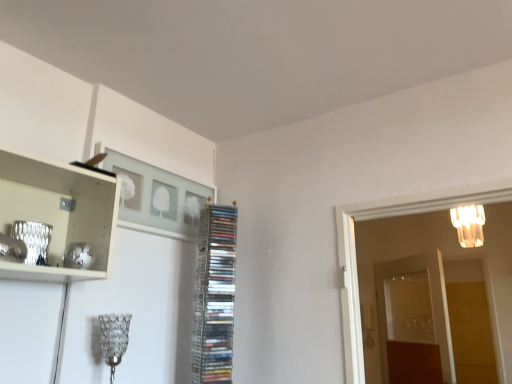
Question: Does transparent glass door at right, placed as the first glass door when sorted from right to left, have a lesser width compared to translucent glass chandelier at upper right, the 1th lamp from the back?

Choices:
 (A) no
 (B) yes

Answer: (B)

Question: Is transparent glass door at right, marked as the second glass door in a left-to-right arrangement, further to camera compared to translucent glass chandelier at upper right, which ranks as the 2th lamp in bottom-to-top order?

Choices:
 (A) no
 (B) yes

Answer: (B)

Question: Considering the relative sizes of transparent glass door at right, marked as the second glass door in a left-to-right arrangement, and translucent glass chandelier at upper right, which ranks as the second lamp in front-to-back order, in the image provided, is transparent glass door at right, marked as the second glass door in a left-to-right arrangement, shorter than translucent glass chandelier at upper right, which ranks as the second lamp in front-to-back order,?

Choices:
 (A) yes
 (B) no

Answer: (B)

Question: From the image's perspective, is transparent glass door at right, placed as the first glass door when sorted from right to left, under translucent glass chandelier at upper right, acting as the first lamp starting from the top?

Choices:
 (A) yes
 (B) no

Answer: (A)

Question: Is the position of transparent glass door at right, marked as the second glass door in a left-to-right arrangement, less distant than that of translucent glass chandelier at upper right, acting as the first lamp starting from the top?

Choices:
 (A) yes
 (B) no

Answer: (B)

Question: Could you tell me if transparent glass door at right, marked as the second glass door in a left-to-right arrangement, is turned towards translucent glass chandelier at upper right, acting as the first lamp starting from the top?

Choices:
 (A) no
 (B) yes

Answer: (B)

Question: Is transparent glass door at right, acting as the 2th glass door starting from the right, inside clear plastic rack of cds at center?

Choices:
 (A) no
 (B) yes

Answer: (A)

Question: Considering the relative sizes of clear plastic rack of cds at center and transparent glass door at right, acting as the 2th glass door starting from the right, in the image provided, is clear plastic rack of cds at center wider than transparent glass door at right, acting as the 2th glass door starting from the right,?

Choices:
 (A) no
 (B) yes

Answer: (B)

Question: Does clear plastic rack of cds at center turn towards transparent glass door at right, acting as the 2th glass door starting from the right?

Choices:
 (A) no
 (B) yes

Answer: (A)

Question: Is clear plastic rack of cds at center completely or partially outside of transparent glass door at right, which is the 1th glass door from left to right?

Choices:
 (A) no
 (B) yes

Answer: (B)

Question: From a real-world perspective, is clear plastic rack of cds at center located higher than transparent glass door at right, acting as the 2th glass door starting from the right?

Choices:
 (A) no
 (B) yes

Answer: (B)

Question: Is clear plastic rack of cds at center further to camera compared to transparent glass door at right, which is the 1th glass door from left to right?

Choices:
 (A) yes
 (B) no

Answer: (B)

Question: Is transparent glass door at right, marked as the second glass door in a left-to-right arrangement, aimed at clear plastic rack of cds at center?

Choices:
 (A) yes
 (B) no

Answer: (A)